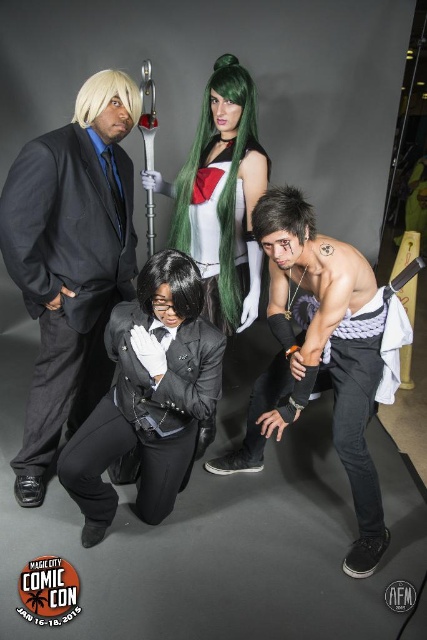
You are a photographer at the convention center. You want to take a photo that includes both point (146, 172) and point (146, 260). Which point should you focus on to ensure both are in sharp focus?

You should focus on point (146, 172) because it is closer to the camera than point (146, 260). By focusing on the closer point, the depth of field will likely include the farther point as well.

You are standing at the point labeled as point (x=78, y=104) and want to move to the point labeled as point (x=272, y=204). Is the direction you need to walk towards the front or the back of the scene?

The point labeled as point (x=272, y=204) is in front of the point labeled as point (x=78, y=104), so you need to walk towards the front of the scene.